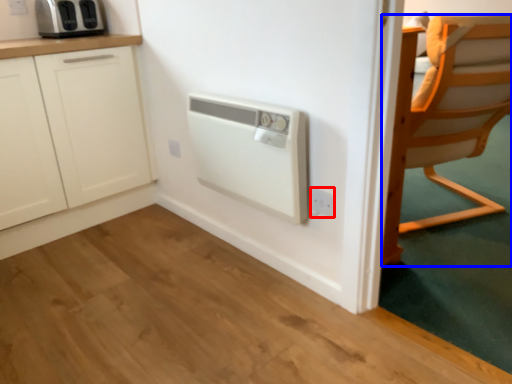
Question: Which point is closer to the camera, electric outlet (highlighted by a red box) or chair (highlighted by a blue box)?

Choices:
 (A) electric outlet
 (B) chair

Answer: (A)